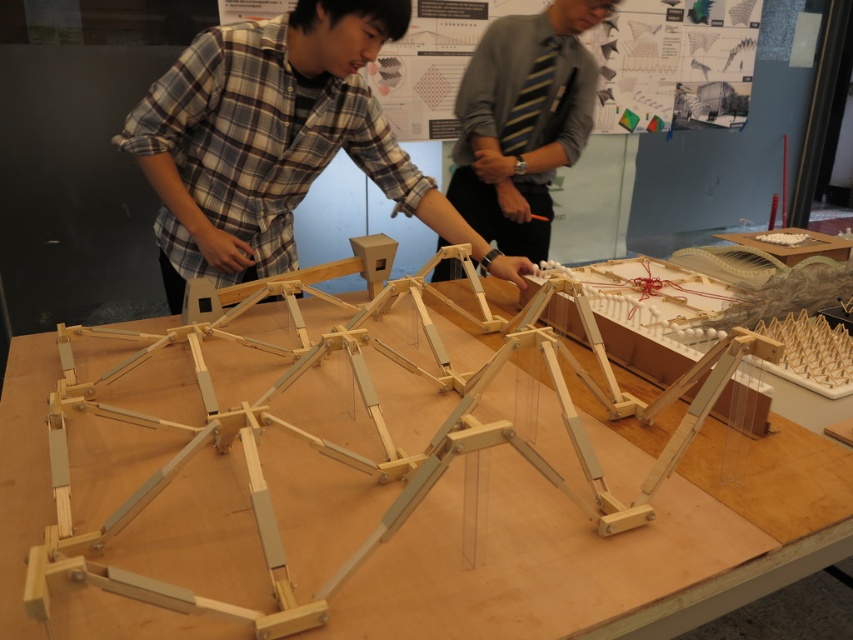
Question: Estimate the real-world distances between objects in this image. Which object is closer to the striped tie at center?

Choices:
 (A) plaid shirt at center
 (B) wooden frame at center

Answer: (A)

Question: Which of the following is the farthest from the observer?

Choices:
 (A) striped tie at center
 (B) plaid shirt at center
 (C) wooden frame at center

Answer: (A)

Question: Does plaid shirt at center appear over striped tie at center?

Choices:
 (A) yes
 (B) no

Answer: (B)

Question: Does plaid shirt at center appear over striped tie at center?

Choices:
 (A) yes
 (B) no

Answer: (B)

Question: Does plaid shirt at center have a greater width compared to striped tie at center?

Choices:
 (A) yes
 (B) no

Answer: (A)

Question: Which point is farther to the camera?

Choices:
 (A) plaid shirt at center
 (B) wooden frame at center
 (C) striped tie at center

Answer: (C)